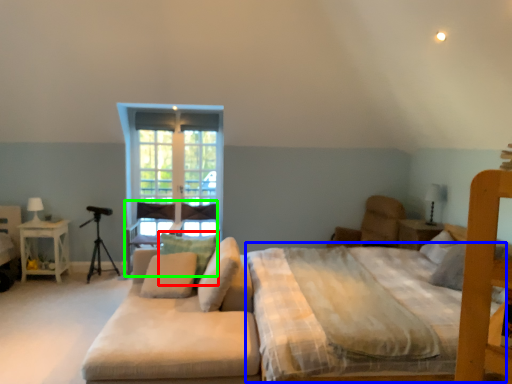
Question: Which object is the farthest from pillow (highlighted by a red box)? Choose among these: mattress (highlighted by a blue box) or armchair (highlighted by a green box).

Choices:
 (A) mattress
 (B) armchair

Answer: (B)